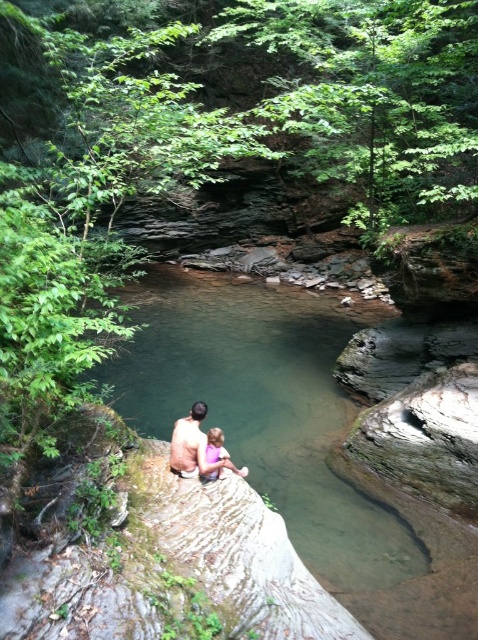
Question: Does clear water at center have a greater width compared to smooth skin man at center?

Choices:
 (A) no
 (B) yes

Answer: (B)

Question: Which object is farther from the camera taking this photo?

Choices:
 (A) pink fabric at center
 (B) smooth skin man at center

Answer: (A)

Question: Does smooth skin man at center have a smaller size compared to pink fabric at center?

Choices:
 (A) no
 (B) yes

Answer: (A)

Question: Observing the image, what is the correct spatial positioning of clear water at center in reference to pink fabric at center?

Choices:
 (A) below
 (B) above

Answer: (B)

Question: Which object is positioned closest to the pink fabric at center?

Choices:
 (A) smooth skin man at center
 (B) clear water at center

Answer: (A)

Question: Which object is farther from the camera taking this photo?

Choices:
 (A) smooth skin man at center
 (B) pink fabric at center
 (C) clear water at center

Answer: (C)